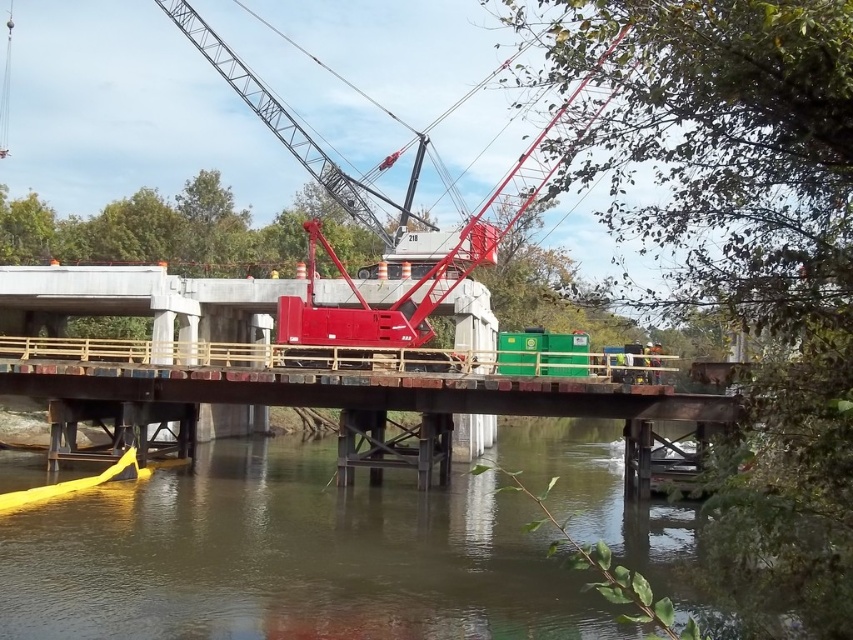
Question: Is metal bridge at lower center thinner than metallic red crane at center?

Choices:
 (A) yes
 (B) no

Answer: (A)

Question: Among these points, which one is nearest to the camera?

Choices:
 (A) (20, 481)
 (B) (300, 308)

Answer: (A)

Question: Which point appears farthest from the camera in this image?

Choices:
 (A) (241, 570)
 (B) (527, 177)

Answer: (B)

Question: Can you confirm if brown murky water at lower center is positioned to the right of metal bridge at lower center?

Choices:
 (A) no
 (B) yes

Answer: (A)

Question: Is brown murky water at lower center to the right of metallic red crane at center from the viewer's perspective?

Choices:
 (A) yes
 (B) no

Answer: (A)

Question: Which point appears closest to the camera in this image?

Choices:
 (A) (593, 433)
 (B) (395, 330)

Answer: (B)